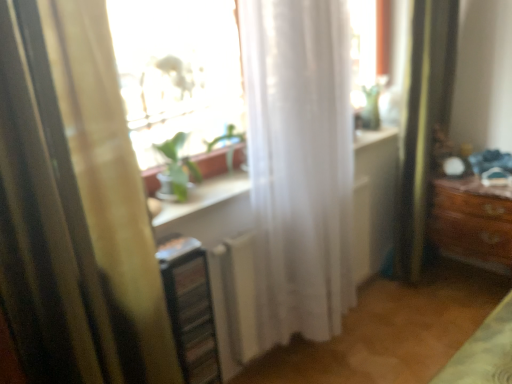
You are a GUI agent. You are given a task and a screenshot of the screen. Output one action in this format:
    pyautogui.click(x=<x>, y=<y>)
    Task: Click on the white sheer curtain at center, placed as the second curtain when sorted from left to right
    
    Given the screenshot: What is the action you would take?
    pyautogui.click(x=300, y=163)

This screenshot has width=512, height=384. I want to click on yellow striped curtain at left, the 1th curtain positioned from the left, so click(74, 206).

Measure the distance between point (428, 120) and camera.

7.71 feet.

The image size is (512, 384). Find the location of `green fabric shower curtain at right`. green fabric shower curtain at right is located at coordinates [424, 123].

I want to click on metallic silver shelf at lower left, so click(x=190, y=308).

What do you see at coordinates (177, 72) in the screenshot? This screenshot has height=384, width=512. I see `transparent glass window at center` at bounding box center [177, 72].

This screenshot has width=512, height=384. In order to click on white sheer curtain at center, placed as the second curtain when sorted from left to right in this screenshot , I will do `click(300, 163)`.

From the image's perspective, relative to yellow striped curtain at left, the 1th curtain positioned from the left, is metallic silver shelf at lower left above or below?

metallic silver shelf at lower left is below yellow striped curtain at left, the 1th curtain positioned from the left.

Considering the relative sizes of metallic silver shelf at lower left and yellow striped curtain at left, the 1th curtain positioned from the left, in the image provided, is metallic silver shelf at lower left bigger than yellow striped curtain at left, the 1th curtain positioned from the left,?

No.

From a real-world perspective, relative to white sheer curtain at center, positioned as the 1th curtain in right-to-left order, is transparent glass window at center vertically above or below?

In terms of real-world spatial position, transparent glass window at center is above white sheer curtain at center, positioned as the 1th curtain in right-to-left order.

Considering the sizes of transparent glass window at center and white sheer curtain at center, positioned as the 1th curtain in right-to-left order, in the image, is transparent glass window at center taller or shorter than white sheer curtain at center, positioned as the 1th curtain in right-to-left order,?

Clearly, transparent glass window at center is shorter compared to white sheer curtain at center, positioned as the 1th curtain in right-to-left order.

Is transparent glass window at center not inside white sheer curtain at center, positioned as the 1th curtain in right-to-left order?

Indeed, transparent glass window at center is completely outside white sheer curtain at center, positioned as the 1th curtain in right-to-left order.

At what (x,y) coordinates should I click in order to perform the action: click on curtain that is the 1st object located below the transparent glass window at center (from the image's perspective). Please return your answer as a coordinate pair (x, y). Looking at the image, I should click on (300, 163).

From a real-world perspective, is white sheer curtain at center, placed as the second curtain when sorted from left to right, on top of transparent glass window at center?

No, from a real-world perspective, white sheer curtain at center, placed as the second curtain when sorted from left to right, is not above transparent glass window at center.

The height and width of the screenshot is (384, 512). In order to click on window that is above the white sheer curtain at center, placed as the second curtain when sorted from left to right (from a real-world perspective) in this screenshot , I will do `click(177, 72)`.

From the image's perspective, is white sheer curtain at center, positioned as the 1th curtain in right-to-left order, positioned above or below transparent glass window at center?

From the image's perspective, white sheer curtain at center, positioned as the 1th curtain in right-to-left order, appears below transparent glass window at center.

Locate an element on the screen. curtain on the left of transparent glass window at center is located at coordinates (74, 206).

Is the surface of transparent glass window at center in direct contact with yellow striped curtain at left, placed as the 2th curtain when sorted from right to left?

No, transparent glass window at center is not beside yellow striped curtain at left, placed as the 2th curtain when sorted from right to left.

Can you confirm if transparent glass window at center is positioned to the right of yellow striped curtain at left, the 1th curtain positioned from the left?

Correct, you'll find transparent glass window at center to the right of yellow striped curtain at left, the 1th curtain positioned from the left.

In the image, is transparent glass window at center positioned in front of or behind yellow striped curtain at left, placed as the 2th curtain when sorted from right to left?

Clearly, transparent glass window at center is behind yellow striped curtain at left, placed as the 2th curtain when sorted from right to left.

Considering the relative sizes of green fabric shower curtain at right and transparent glass window at center in the image provided, is green fabric shower curtain at right wider than transparent glass window at center?

In fact, green fabric shower curtain at right might be narrower than transparent glass window at center.

From a real-world perspective, which object rests below the other?

green fabric shower curtain at right, from a real-world perspective.

Relative to transparent glass window at center, is green fabric shower curtain at right in front or behind?

green fabric shower curtain at right is behind transparent glass window at center.

Is green fabric shower curtain at right located outside transparent glass window at center?

That's correct, green fabric shower curtain at right is outside of transparent glass window at center.

Is green fabric shower curtain at right a part of metallic silver shelf at lower left?

No, green fabric shower curtain at right is located outside of metallic silver shelf at lower left.

Based on the photo, what's the angular difference between metallic silver shelf at lower left and green fabric shower curtain at right's facing directions?

metallic silver shelf at lower left and green fabric shower curtain at right are facing 1.21 degrees away from each other.

In the image, there is a metallic silver shelf at lower left. At what (x,y) coordinates should I click in order to perform the action: click on shower curtain above it (from the image's perspective). Please return your answer as a coordinate pair (x, y). The width and height of the screenshot is (512, 384). Looking at the image, I should click on [424, 123].

Which of these two, white sheer curtain at center, placed as the second curtain when sorted from left to right, or metallic silver shelf at lower left, stands shorter?

A: metallic silver shelf at lower left.

Would you say white sheer curtain at center, positioned as the 1th curtain in right-to-left order, is inside or outside metallic silver shelf at lower left?

white sheer curtain at center, positioned as the 1th curtain in right-to-left order, is not enclosed by metallic silver shelf at lower left.

In the scene shown: From the image's perspective, is white sheer curtain at center, placed as the second curtain when sorted from left to right, on metallic silver shelf at lower left?

Yes, from the image's perspective, white sheer curtain at center, placed as the second curtain when sorted from left to right, is on top of metallic silver shelf at lower left.

Image resolution: width=512 pixels, height=384 pixels. I want to click on curtain on the right of metallic silver shelf at lower left, so click(x=300, y=163).

Find the location of a particular element. Image resolution: width=512 pixels, height=384 pixels. shelf below the yellow striped curtain at left, placed as the 2th curtain when sorted from right to left (from the image's perspective) is located at coordinates (190, 308).

Identify the location of curtain located on the right of transparent glass window at center. The width and height of the screenshot is (512, 384). (300, 163).

Which object lies further to the anchor point green fabric shower curtain at right, white sheer curtain at center, placed as the second curtain when sorted from left to right, or yellow striped curtain at left, the 1th curtain positioned from the left?

The object further to green fabric shower curtain at right is yellow striped curtain at left, the 1th curtain positioned from the left.

Considering their positions, is metallic silver shelf at lower left positioned closer to green fabric shower curtain at right than transparent glass window at center?

transparent glass window at center is closer to green fabric shower curtain at right.

Looking at the image, which one is located closer to yellow striped curtain at left, placed as the 2th curtain when sorted from right to left, white sheer curtain at center, positioned as the 1th curtain in right-to-left order, or transparent glass window at center?

white sheer curtain at center, positioned as the 1th curtain in right-to-left order, is positioned closer to the anchor yellow striped curtain at left, placed as the 2th curtain when sorted from right to left.

Which object lies nearer to the anchor point white sheer curtain at center, positioned as the 1th curtain in right-to-left order, transparent glass window at center or yellow striped curtain at left, placed as the 2th curtain when sorted from right to left?

The object closer to white sheer curtain at center, positioned as the 1th curtain in right-to-left order, is transparent glass window at center.

Which object lies further to the anchor point metallic silver shelf at lower left, white sheer curtain at center, placed as the second curtain when sorted from left to right, or transparent glass window at center?

Among the two, transparent glass window at center is located further to metallic silver shelf at lower left.

Estimate the real-world distances between objects in this image. Which object is closer to yellow striped curtain at left, the 1th curtain positioned from the left, white sheer curtain at center, positioned as the 1th curtain in right-to-left order, or metallic silver shelf at lower left?

Among the two, metallic silver shelf at lower left is located nearer to yellow striped curtain at left, the 1th curtain positioned from the left.

From the image, which object appears to be farther from yellow striped curtain at left, placed as the 2th curtain when sorted from right to left, metallic silver shelf at lower left or transparent glass window at center?

Based on the image, transparent glass window at center appears to be further to yellow striped curtain at left, placed as the 2th curtain when sorted from right to left.

When comparing their distances from white sheer curtain at center, positioned as the 1th curtain in right-to-left order, does metallic silver shelf at lower left or transparent glass window at center seem closer?

The object closer to white sheer curtain at center, positioned as the 1th curtain in right-to-left order, is metallic silver shelf at lower left.

This screenshot has height=384, width=512. I want to click on window between yellow striped curtain at left, the 1th curtain positioned from the left, and white sheer curtain at center, positioned as the 1th curtain in right-to-left order, in the horizontal direction, so click(x=177, y=72).

Where is `window between yellow striped curtain at left, placed as the 2th curtain when sorted from right to left, and green fabric shower curtain at right, in the horizontal direction`? The width and height of the screenshot is (512, 384). window between yellow striped curtain at left, placed as the 2th curtain when sorted from right to left, and green fabric shower curtain at right, in the horizontal direction is located at coordinates (177, 72).

Locate an element on the screen. The height and width of the screenshot is (384, 512). shelf between transparent glass window at center and green fabric shower curtain at right in the horizontal direction is located at coordinates (190, 308).

Where is `curtain between metallic silver shelf at lower left and green fabric shower curtain at right from left to right`? The width and height of the screenshot is (512, 384). curtain between metallic silver shelf at lower left and green fabric shower curtain at right from left to right is located at coordinates (300, 163).